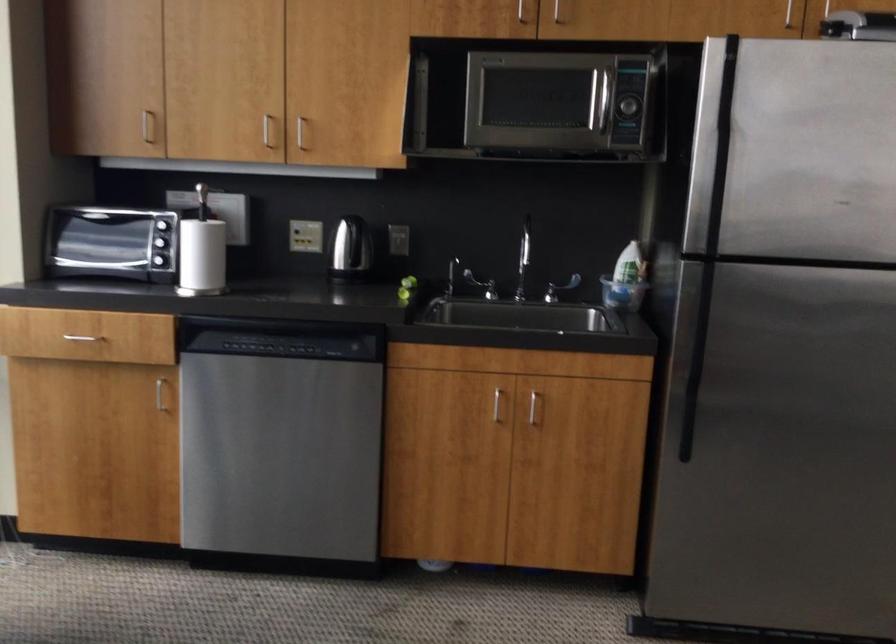
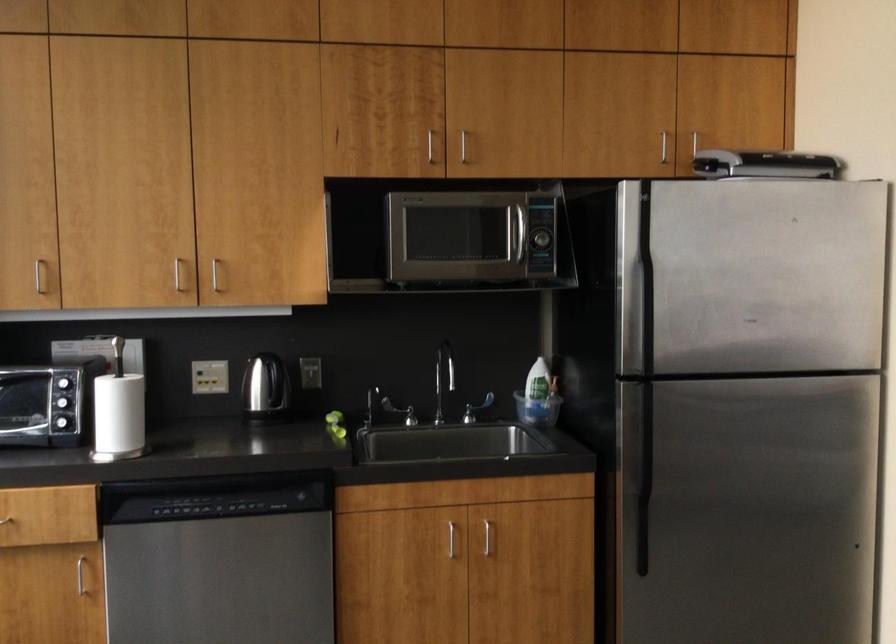
Where in the second image is the point corresponding to point (692, 366) from the first image?

(643, 480)